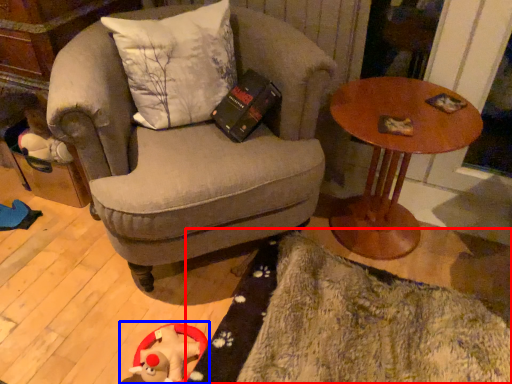
Question: Which object is further to the camera taking this photo, mat (highlighted by a red box) or toy (highlighted by a blue box)?

Choices:
 (A) mat
 (B) toy

Answer: (B)